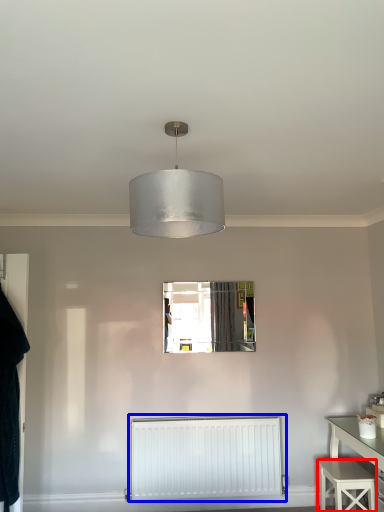
Question: Which point is closer to the camera, stool (highlighted by a red box) or radiator (highlighted by a blue box)?

Choices:
 (A) stool
 (B) radiator

Answer: (A)